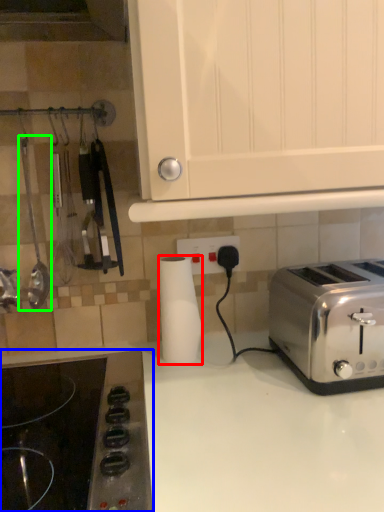
Question: Estimate the real-world distances between objects in this image. Which object is closer to paper towel (highlighted by a red box), gas stove (highlighted by a blue box) or appliance (highlighted by a green box)?

Choices:
 (A) gas stove
 (B) appliance

Answer: (A)